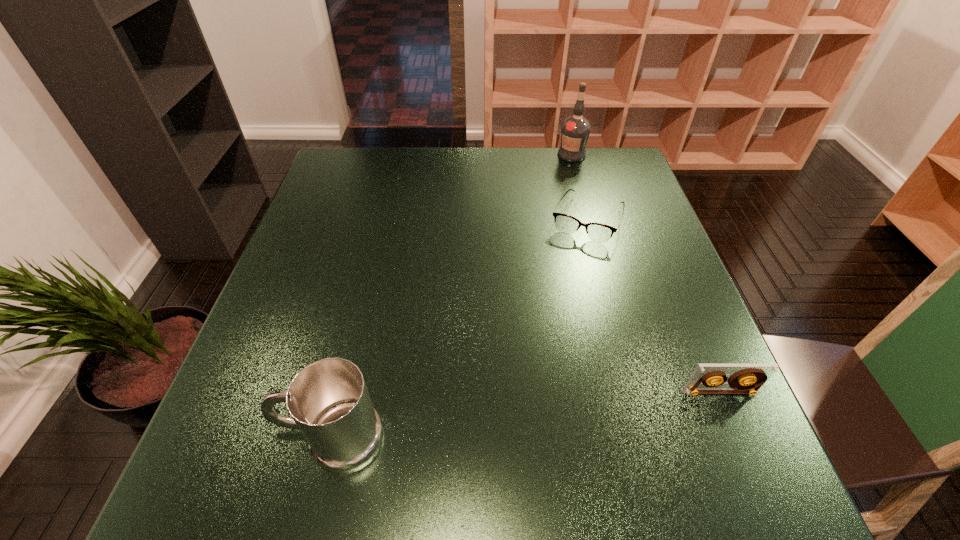
Identify the location of the nearest object. (328, 400).

You are a GUI agent. You are given a task and a screenshot of the screen. Output one action in this format:
    pyautogui.click(x=<x>, y=<y>)
    Task: Click on the second tallest object
    Image resolution: width=960 pixels, height=540 pixels.
    Given the screenshot: What is the action you would take?
    pyautogui.click(x=328, y=400)

Image resolution: width=960 pixels, height=540 pixels. I want to click on the third tallest object, so pos(746,378).

Where is `videotape`? The width and height of the screenshot is (960, 540). videotape is located at coordinates (746, 378).

Locate an element on the screen. This screenshot has width=960, height=540. spectacles is located at coordinates (598, 232).

Locate an element on the screen. The image size is (960, 540). the second farthest object is located at coordinates (598, 232).

The image size is (960, 540). What are the coordinates of `the farthest object` in the screenshot? It's located at (575, 130).

I want to click on vodka, so click(575, 130).

Identify the location of free space located 0.100m on the side of the second tallest object with the handle. (225, 439).

The height and width of the screenshot is (540, 960). In order to click on vacant space positioned on the side of the second tallest object with the handle in this screenshot , I will do `click(243, 439)`.